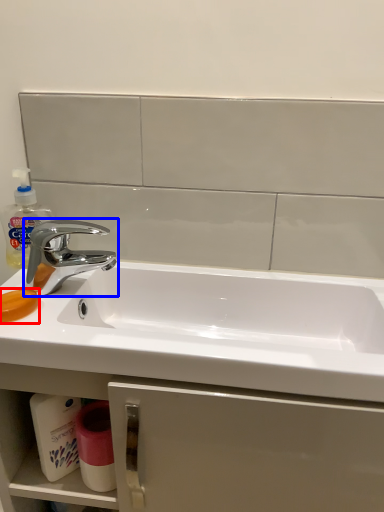
Question: Among these objects, which one is farthest to the camera, soap (highlighted by a red box) or tap (highlighted by a blue box)?

Choices:
 (A) soap
 (B) tap

Answer: (B)